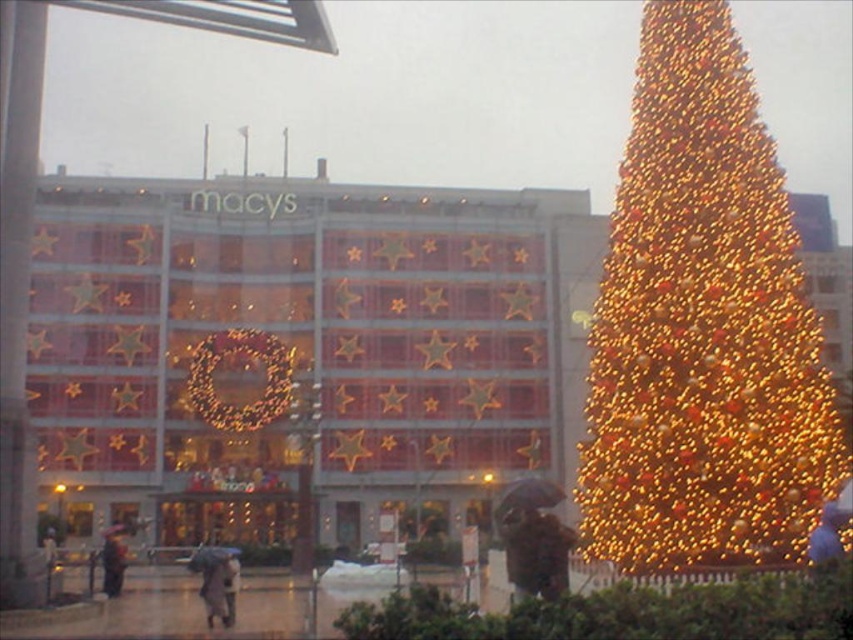
Can you confirm if illuminated gold christmas tree at right is thinner than dark gray coat at lower left?

No, illuminated gold christmas tree at right is not thinner than dark gray coat at lower left.

This screenshot has width=853, height=640. What do you see at coordinates (703, 326) in the screenshot?
I see `illuminated gold christmas tree at right` at bounding box center [703, 326].

The height and width of the screenshot is (640, 853). In order to click on illuminated gold christmas tree at right in this screenshot , I will do `click(703, 326)`.

Between point (671, 195) and point (836, 515), which one is positioned in front?

Point (836, 515)

Is illuminated gold christmas tree at right to the left of blue fabric umbrella at lower right from the viewer's perspective?

Indeed, illuminated gold christmas tree at right is positioned on the left side of blue fabric umbrella at lower right.

The width and height of the screenshot is (853, 640). Identify the location of illuminated gold christmas tree at right. (703, 326).

Where is `illuminated gold christmas tree at right`? illuminated gold christmas tree at right is located at coordinates (703, 326).

Based on the photo, can you confirm if blue fabric umbrella at lower right is positioned to the right of dark gray coat at lower left?

Indeed, blue fabric umbrella at lower right is positioned on the right side of dark gray coat at lower left.

Locate an element on the screen. This screenshot has width=853, height=640. blue fabric umbrella at lower right is located at coordinates (828, 532).